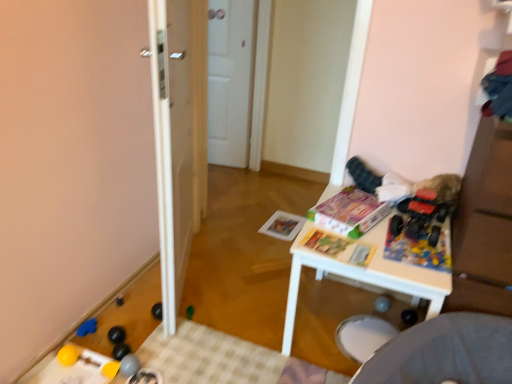
The image size is (512, 384). What are the coordinates of `vacant area on top of white plastic table at center (from a real-world perspective)` in the screenshot? It's located at (373, 227).